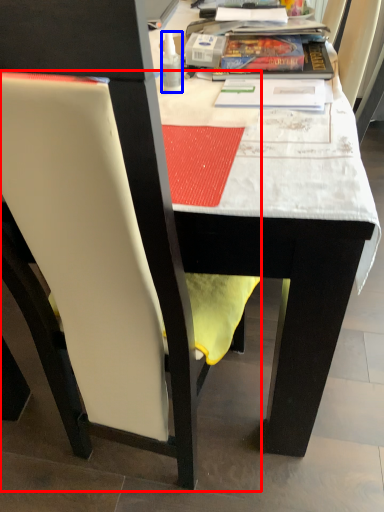
Question: Which of the following is the farthest to the observer, chair (highlighted by a red box) or bottle (highlighted by a blue box)?

Choices:
 (A) chair
 (B) bottle

Answer: (B)